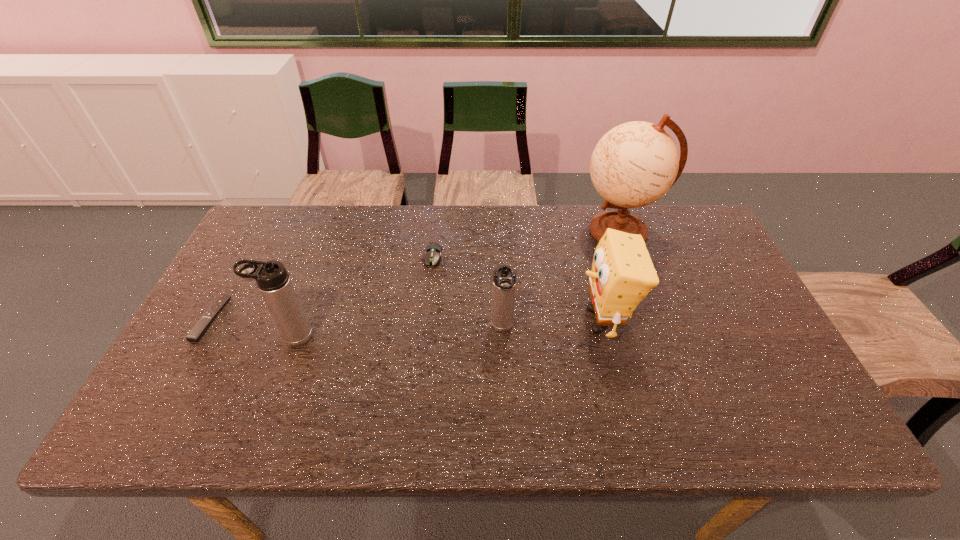
Locate an element on the screen. Image resolution: width=960 pixels, height=540 pixels. free space at the right edge of the desktop is located at coordinates (720, 255).

What are the coordinates of `vacant space at the far right corner of the desktop` in the screenshot? It's located at (699, 219).

Where is `unoccupied position between the leftmost object and the fourth tallest object`? This screenshot has width=960, height=540. unoccupied position between the leftmost object and the fourth tallest object is located at coordinates (356, 323).

I want to click on free space between the computer mouse and the tallest object, so click(526, 244).

Locate an element on the screen. The height and width of the screenshot is (540, 960). vacant area that lies between the fourth object from left to right and the left thermos bottle is located at coordinates (397, 333).

Find the location of a particular element. Image resolution: width=960 pixels, height=540 pixels. free space between the sponge and the shortest object is located at coordinates (406, 320).

This screenshot has width=960, height=540. I want to click on free spot between the fourth tallest object and the tallest object, so click(x=561, y=280).

The height and width of the screenshot is (540, 960). I want to click on blank region between the taller thermos bottle and the remote control, so click(x=252, y=328).

Where is `vacant area that lies between the shortest object and the globe`? The image size is (960, 540). vacant area that lies between the shortest object and the globe is located at coordinates (416, 275).

Where is `free space between the fifth object from right to left and the sponge`? This screenshot has width=960, height=540. free space between the fifth object from right to left and the sponge is located at coordinates (446, 328).